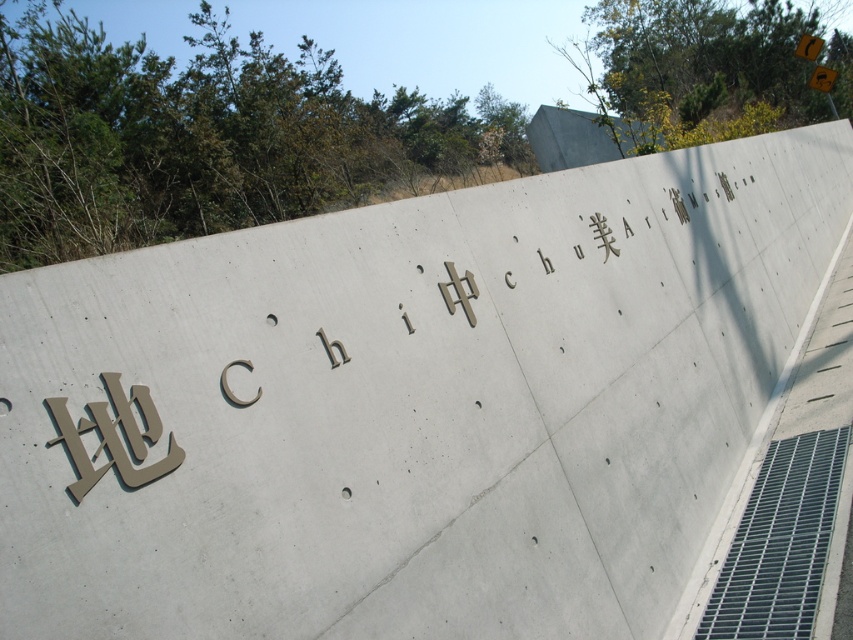
Question: Can you confirm if yellow reflective plastic at upper right is positioned to the left of yellow plastic sign at upper right?

Choices:
 (A) no
 (B) yes

Answer: (B)

Question: Among these objects, which one is farthest from the camera?

Choices:
 (A) yellow plastic sign at upper right
 (B) yellow reflective plastic at upper right

Answer: (B)

Question: Among these objects, which one is farthest from the camera?

Choices:
 (A) yellow reflective plastic at upper right
 (B) yellow plastic sign at upper right

Answer: (A)

Question: Which point is closer to the camera?

Choices:
 (A) (809, 45)
 (B) (833, 72)

Answer: (B)

Question: Is the position of yellow reflective plastic at upper right more distant than that of yellow plastic sign at upper right?

Choices:
 (A) yes
 (B) no

Answer: (A)

Question: Does yellow reflective plastic at upper right have a larger size compared to yellow plastic sign at upper right?

Choices:
 (A) yes
 (B) no

Answer: (B)